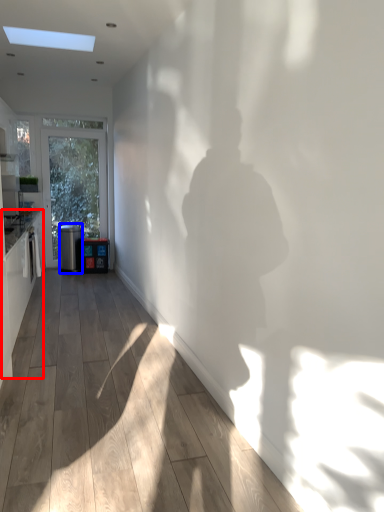
Question: Among these objects, which one is nearest to the camera, cabinetry (highlighted by a red box) or appliance (highlighted by a blue box)?

Choices:
 (A) cabinetry
 (B) appliance

Answer: (A)